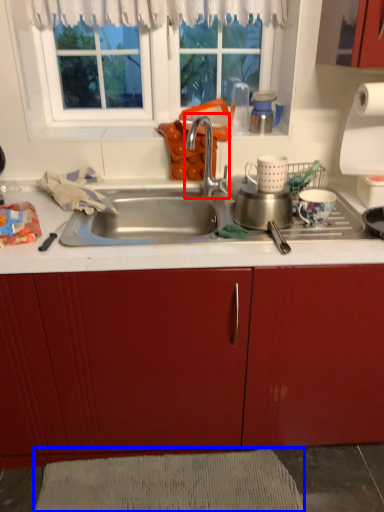
Question: Which of the following is the farthest to the observer, tap (highlighted by a red box) or plain (highlighted by a blue box)?

Choices:
 (A) tap
 (B) plain

Answer: (B)